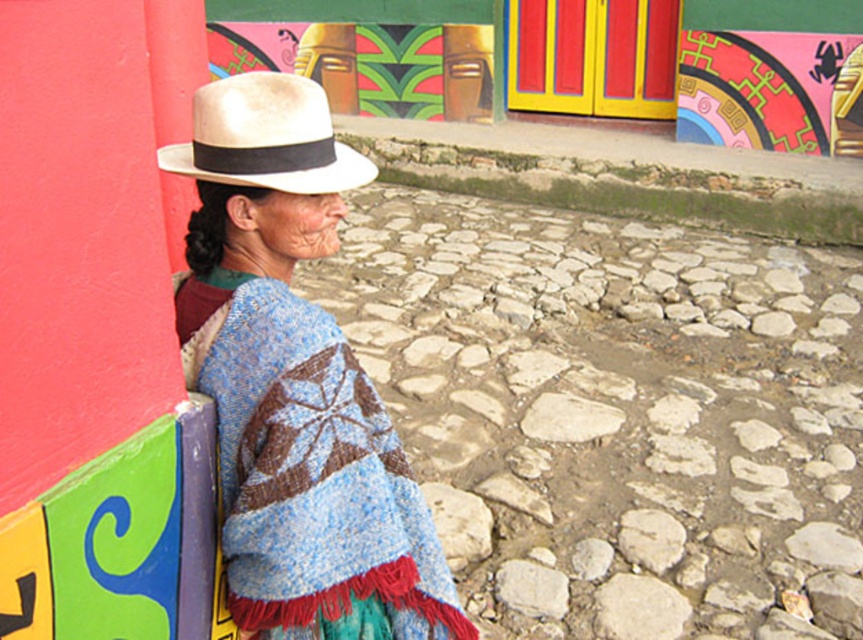
You are an artist trying to sketch the scene. You need to decide which object to draw first based on their sizes. Which object should you draw first, the knitted wool shawl at left or the white straw fedora at upper left?

The knitted wool shawl at left has a greater height compared to the white straw fedora at upper left, so you should draw the knitted wool shawl at left first because it is larger in height.

You are a photographer positioned 1.5 meters away from the knitted wool shawl at left. Can you capture the entire shawl in your camera frame without moving closer?

The knitted wool shawl at left is 1.25 meters away from the viewer. Since you are positioned 1.5 meters away, which is slightly farther than the required distance, you might need to adjust your camera settings or zoom in to ensure the entire shawl fits in the frame.

You are standing 1.29 meters away from the point at coordinates (279,611) in the image. If you want to take a photo of the colorful wall mural behind the person, which direction should you move to get a better view?

Since you are already 1.29 meters away from the point at coordinates (279,611), moving closer or farther might not significantly improve the view. However, adjusting your position sideways could help capture more of the vibrant mural depending on its size and your camera angle.